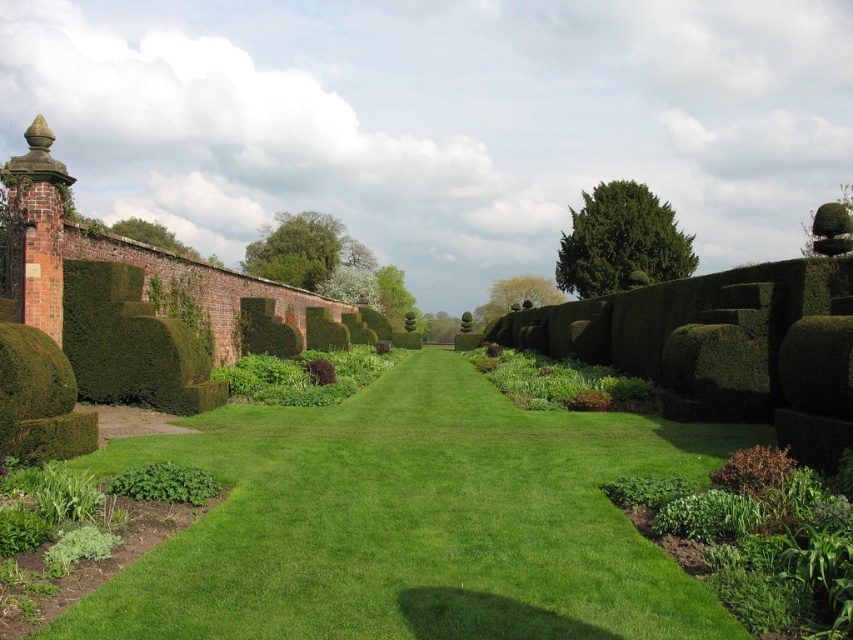
Question: Considering the relative positions of green smooth lawn at center and green leafy bush at upper center in the image provided, where is green smooth lawn at center located with respect to green leafy bush at upper center?

Choices:
 (A) below
 (B) above

Answer: (A)

Question: Can you confirm if green smooth lawn at center is wider than green leafy bush at center?

Choices:
 (A) yes
 (B) no

Answer: (B)

Question: Which is nearer to the green leafy bush at center?

Choices:
 (A) green smooth lawn at center
 (B) green leafy bush at upper center

Answer: (B)

Question: Does green smooth lawn at center appear under green leafy bush at upper center?

Choices:
 (A) yes
 (B) no

Answer: (A)

Question: Which of the following is the closest to the observer?

Choices:
 (A) (158, 548)
 (B) (619, 186)

Answer: (A)

Question: Estimate the real-world distances between objects in this image. Which object is closer to the green leafy bush at center?

Choices:
 (A) green leafy bush at upper center
 (B) green smooth lawn at center

Answer: (A)